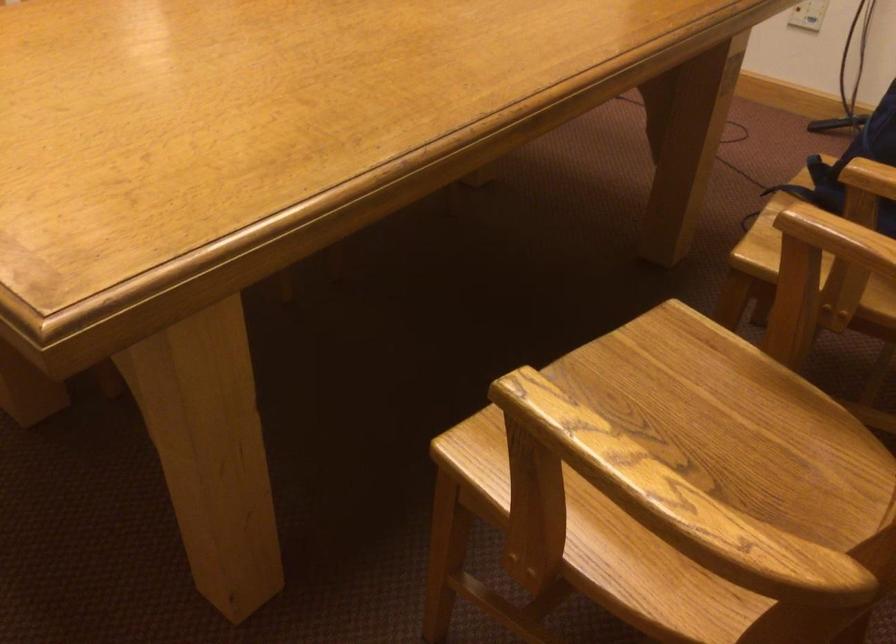
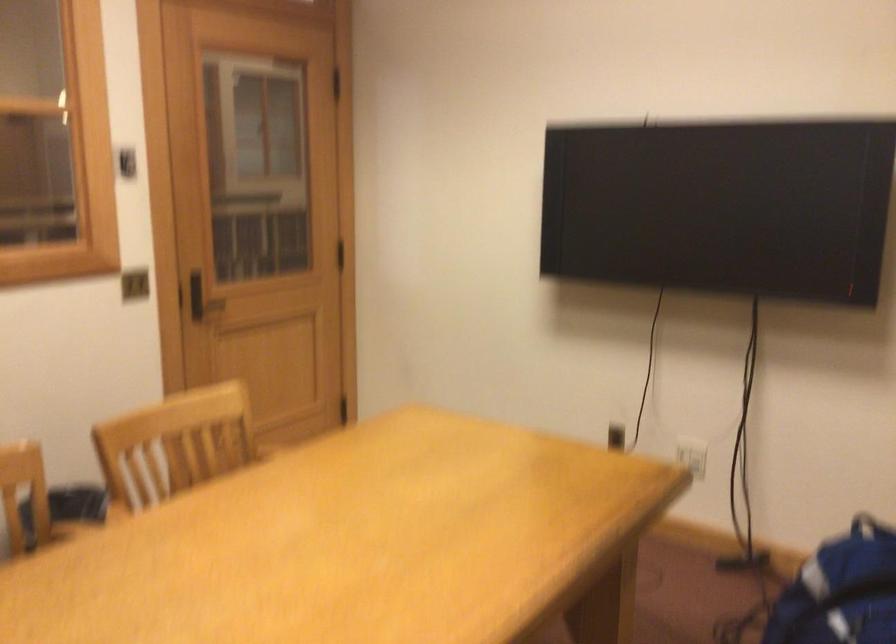
Question: Based on the continuous images, in which direction is the camera rotating? Reply with the corresponding letter.

Choices:
 (A) Left
 (B) Right
 (C) Up
 (D) Down

Answer: (C)